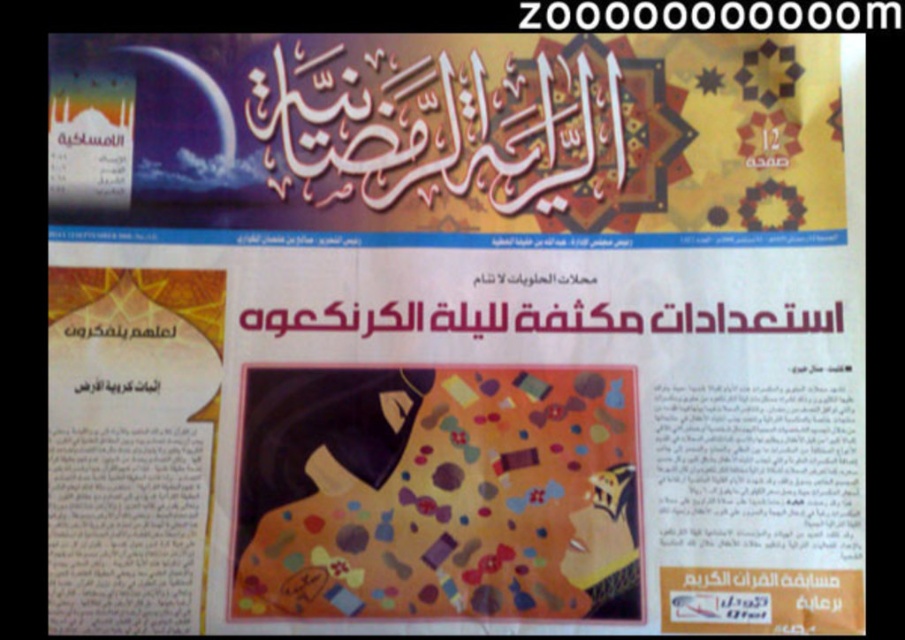
Who is more forward, [898,13] or [119,388]?

Point [119,388] is more forward.

Is black paper at upper center bigger than matte black text at lower left?

Yes, black paper at upper center is bigger than matte black text at lower left.

You are a GUI agent. You are given a task and a screenshot of the screen. Output one action in this format:
    pyautogui.click(x=<x>, y=<y>)
    Task: Click on the black paper at upper center
    The image size is (905, 640).
    Given the screenshot: What is the action you would take?
    pyautogui.click(x=712, y=16)

Locate an element on the screen. The height and width of the screenshot is (640, 905). black paper at upper center is located at coordinates (712, 16).

Can you confirm if matte black text at upper left is smaller than matte black text at lower left?

Incorrect, matte black text at upper left is not smaller in size than matte black text at lower left.

This screenshot has height=640, width=905. Describe the element at coordinates (120, 330) in the screenshot. I see `matte black text at upper left` at that location.

Find the location of `matte black text at upper left`. matte black text at upper left is located at coordinates (120, 330).

Find the location of a particular element. This screenshot has width=905, height=640. matte black text at upper left is located at coordinates (120, 330).

Is multicolored fabric blanket at center behind black paper at center?

No.

Is point (302, 449) positioned after point (583, 326)?

No, it is in front of (583, 326).

Image resolution: width=905 pixels, height=640 pixels. I want to click on multicolored fabric blanket at center, so click(437, 493).